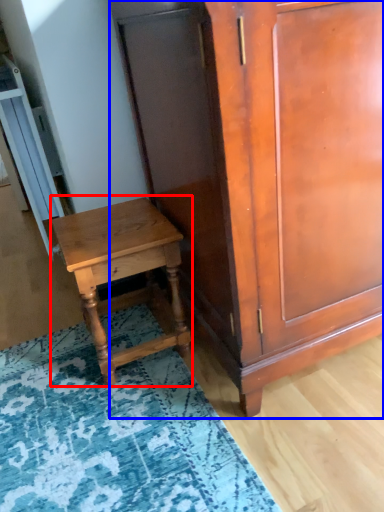
Question: Which of the following is the farthest to the observer, nightstand (highlighted by a red box) or cabinetry (highlighted by a blue box)?

Choices:
 (A) nightstand
 (B) cabinetry

Answer: (A)